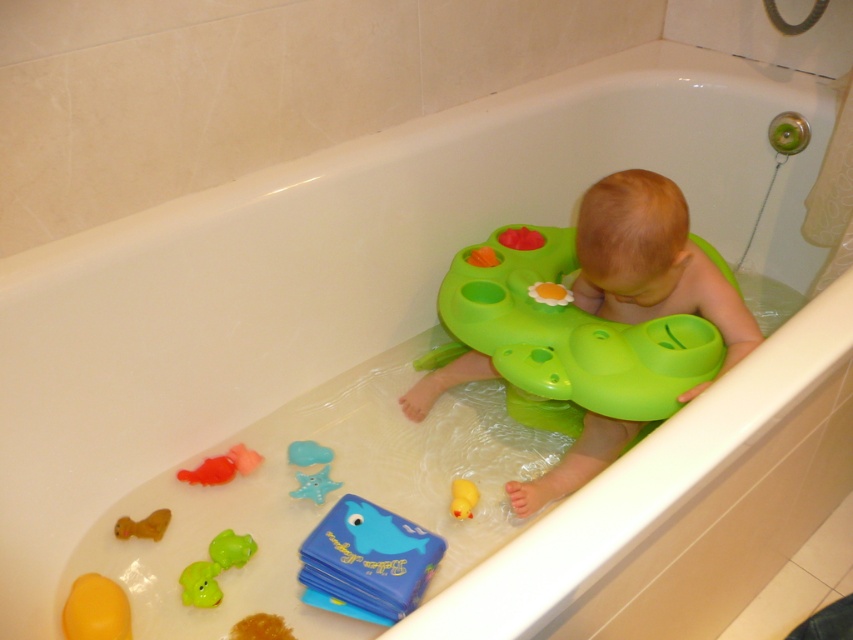
Between green rubber duck at lower left and brown rubber duck at lower left, which one appears on the left side from the viewer's perspective?

brown rubber duck at lower left is more to the left.

Describe the element at coordinates (213, 566) in the screenshot. This screenshot has height=640, width=853. I see `green rubber duck at lower left` at that location.

You are a GUI agent. You are given a task and a screenshot of the screen. Output one action in this format:
    pyautogui.click(x=<x>, y=<y>)
    Task: Click on the green rubber duck at lower left
    The width and height of the screenshot is (853, 640).
    Given the screenshot: What is the action you would take?
    pyautogui.click(x=213, y=566)

Does blue rubber starfish at lower center appear over yellow rubber duck at lower center?

Correct, blue rubber starfish at lower center is located above yellow rubber duck at lower center.

Does point (325, 490) lie behind point (457, 502)?

Yes, point (325, 490) is farther from viewer.

Is point (318, 490) more distant than point (465, 513)?

Yes, it is.

Where is `blue rubber starfish at lower center`? The image size is (853, 640). blue rubber starfish at lower center is located at coordinates (312, 474).

Who is more distant from viewer, (107, 625) or (300, 448)?

Point (300, 448)

Identify the location of yellow rubber duck at lower left. This screenshot has height=640, width=853. point(96,609).

Measure the distance between yellow rubber duck at lower left and camera.

yellow rubber duck at lower left and camera are 3.33 feet apart from each other.

You are a GUI agent. You are given a task and a screenshot of the screen. Output one action in this format:
    pyautogui.click(x=<x>, y=<y>)
    Task: Click on the yellow rubber duck at lower left
    The image size is (853, 640).
    Given the screenshot: What is the action you would take?
    pyautogui.click(x=96, y=609)